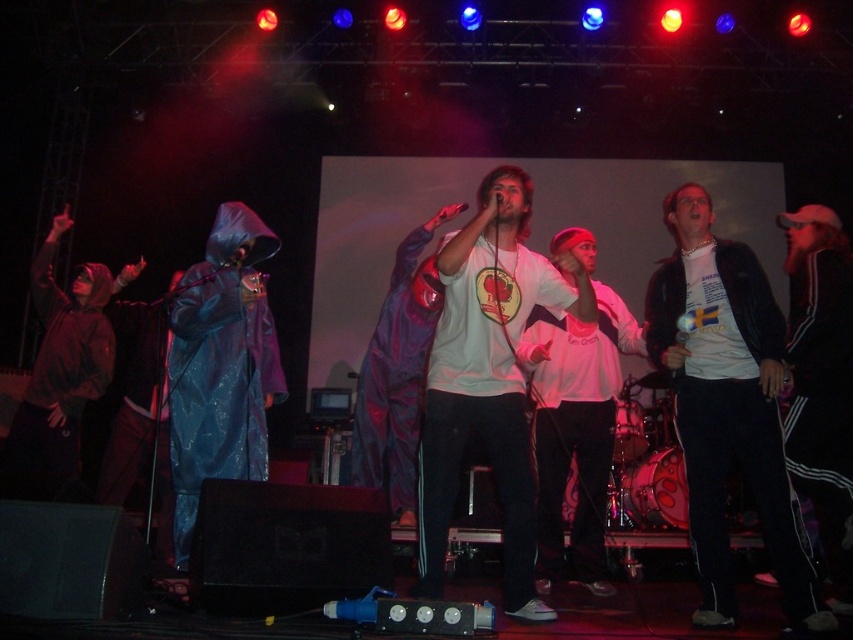
You are a photographer backstage who wants to capture a closeup of the white matte hoodie at center and the shiny purple raincoat at center during the performance. Since you can only focus on one subject at a time, which one should you choose to ensure the other remains in the background?

You should focus on the white matte hoodie at center because it is closer to the viewer than the shiny purple raincoat at center, so if you focus on it, the shiny purple raincoat at center will naturally appear in the background.